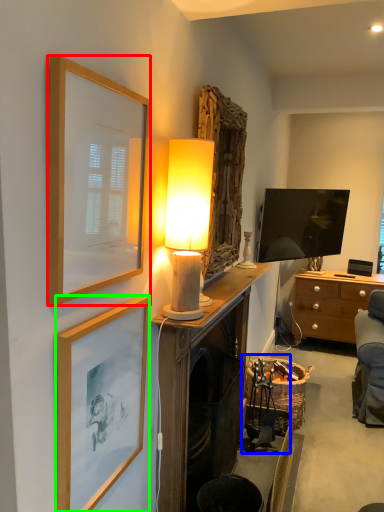
Question: Considering the real-world distances, which object is farthest from picture frame (highlighted by a red box)? swivel chair (highlighted by a blue box) or picture frame (highlighted by a green box)?

Choices:
 (A) swivel chair
 (B) picture frame

Answer: (A)